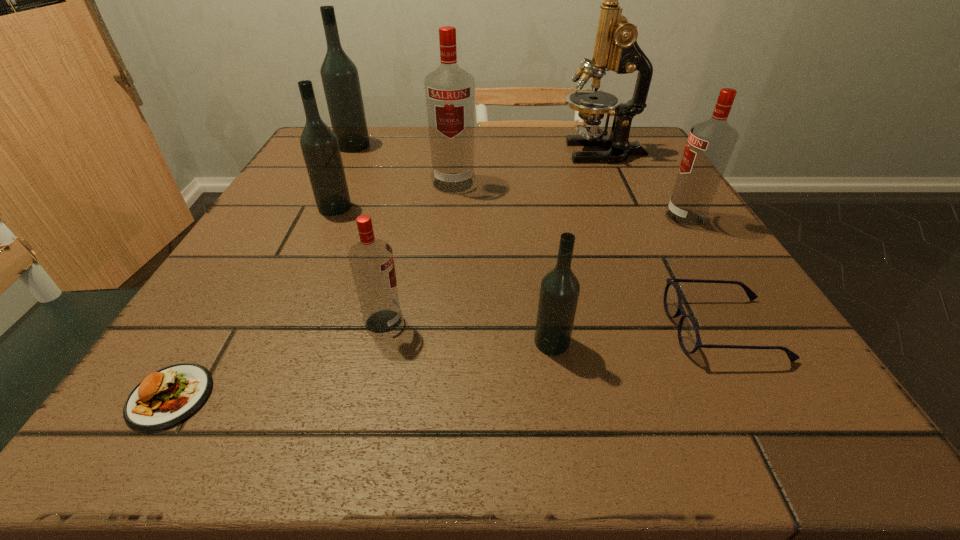
Identify the location of free space located 0.270m on the front label of the rightmost red vodka. Image resolution: width=960 pixels, height=540 pixels. (524, 218).

Where is `free location located 0.310m on the front label of the rightmost red vodka`? This screenshot has height=540, width=960. free location located 0.310m on the front label of the rightmost red vodka is located at coordinates (503, 218).

I want to click on free space located on the front of the second farthest black vodka, so click(x=297, y=290).

Where is `free space located 0.340m on the front label of the leftmost red vodka`? The width and height of the screenshot is (960, 540). free space located 0.340m on the front label of the leftmost red vodka is located at coordinates (637, 322).

This screenshot has width=960, height=540. Identify the location of vacant space situated on the back of the sixth object from left to right. (533, 226).

This screenshot has height=540, width=960. In order to click on free space located 0.090m on the front-facing side of the second shortest object in this screenshot , I will do `click(610, 329)`.

Find the location of `free space located on the front-facing side of the second shortest object`. free space located on the front-facing side of the second shortest object is located at coordinates (540, 329).

The height and width of the screenshot is (540, 960). Find the location of `free space located on the front-facing side of the second shortest object`. free space located on the front-facing side of the second shortest object is located at coordinates (428, 329).

Find the location of a particular element. The width and height of the screenshot is (960, 540). free spot located on the right of the shortest object is located at coordinates (476, 396).

This screenshot has height=540, width=960. I want to click on microscope that is positioned at the far edge, so click(x=616, y=49).